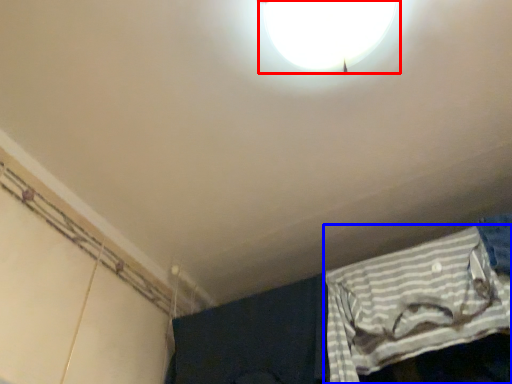
Question: Which object is further to the camera taking this photo, lamp (highlighted by a red box) or curtain (highlighted by a blue box)?

Choices:
 (A) lamp
 (B) curtain

Answer: (B)